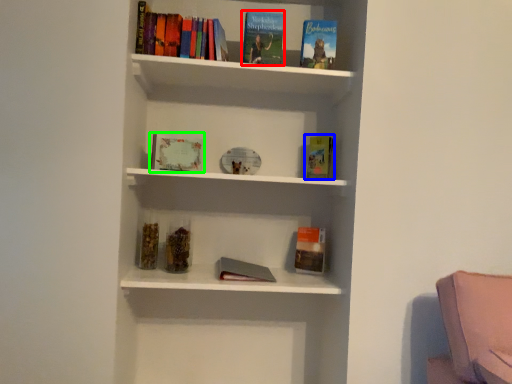
Question: Which object is positioned farthest from book (highlighted by a red box)? Select from paperback book (highlighted by a blue box) and book (highlighted by a green box).

Choices:
 (A) paperback book
 (B) book

Answer: (B)